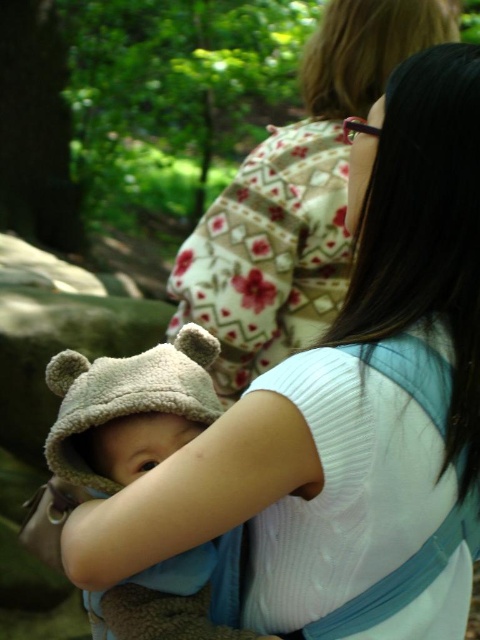
You are standing in the park scene and want to place a small flowerpot between the two points, point (323, 284) and point (130, 438). Which point should the flowerpot be closer to if it needs to be placed closer to the viewer?

The flowerpot should be placed closer to point (323, 284) because it is closer to the viewer compared to point (130, 438).

You are a photographer trying to capture the baby in the scene. You notice the floral fabric kimono at upper center and the soft beige hat at center. Which object should you focus on first if you want to ensure the taller object is in sharp focus?

The floral fabric kimono at upper center should be focused on first because it has a greater height compared to the soft beige hat at center, ensuring the taller object is in sharp focus.

You are standing in the park and see the floral fabric kimono at upper center. If you want to walk towards it, which direction should you move?

The floral fabric kimono at upper center is located at point 0.311 on the x axis and 0.617 on the y axis. To walk towards it, you should move towards the upper center direction.